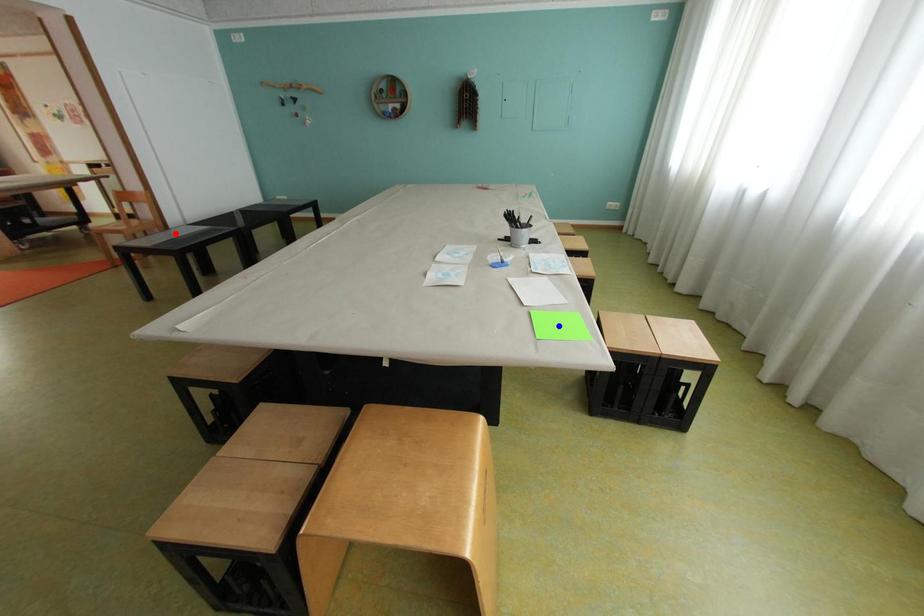
Question: Two points are marked on the image. Which point is closer to the camera?

Choices:
 (A) Blue point is closer.
 (B) Red point is closer.

Answer: (A)